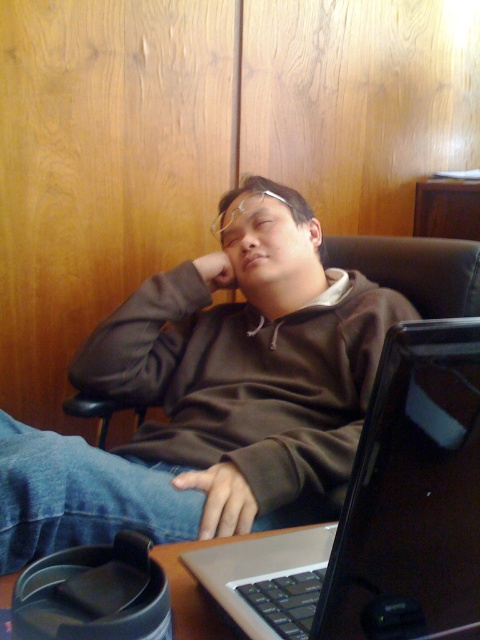
In the scene shown: You are a person who wants to place a small object on the desk in the image. The coordinates given are point (211,394). Where exactly is this point located in relation to the brown fleece at center?

The point (211,394) is on the brown fleece at center.

You are a delivery person entering the office and need to place a package on the desk without disturbing the brown fleece at center or the metallic silver laptop at lower center. Where should you place the package?

The package should be placed to the right of the metallic silver laptop at lower center since the brown fleece at center is already to the left of it, leaving space on the right side.

Based on the photo, you are a delivery robot trying to place a package on the desk in the image. The package requires a flat surface of at least 0.5 meters in width. The desk has an object labeled brown fleece at center. Can you place the package there?

The brown fleece at center is located at point (211, 394), but the question does not provide information about the desk dimensions or available flat surface width. Therefore, it is uncertain if the package can be placed there.